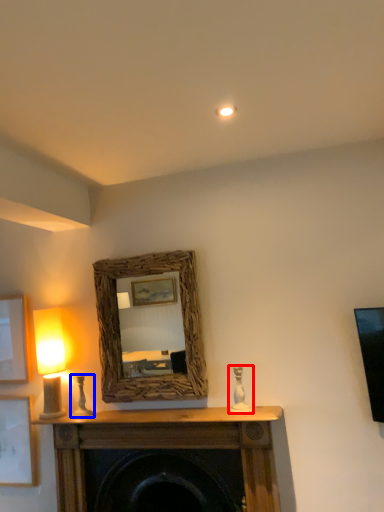
Question: Which object is closer to the camera taking this photo, candle holder (highlighted by a red box) or candle holder (highlighted by a blue box)?

Choices:
 (A) candle holder
 (B) candle holder

Answer: (A)